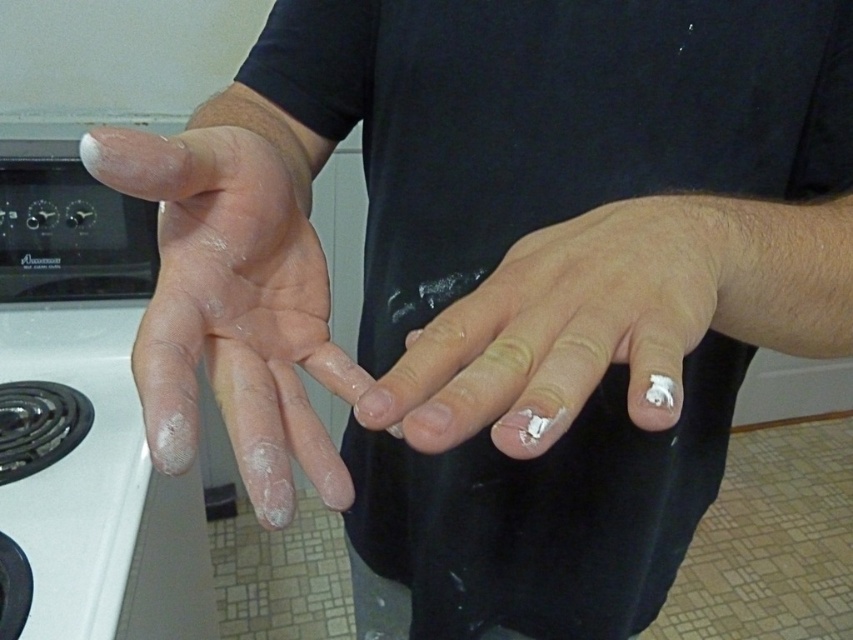
Question: Does white matte hand at center appear over white matte nails at center?

Choices:
 (A) yes
 (B) no

Answer: (A)

Question: Can you confirm if white matte hand at center is positioned above white matte nails at center?

Choices:
 (A) no
 (B) yes

Answer: (B)

Question: Is white matte hand at center smaller than white matte nails at center?

Choices:
 (A) no
 (B) yes

Answer: (A)

Question: Which of the following is the farthest from the observer?

Choices:
 (A) white matte hand at center
 (B) white matte nails at center

Answer: (A)

Question: Which point is closer to the camera?

Choices:
 (A) white matte nails at center
 (B) white matte hand at center

Answer: (A)

Question: Which object is farther from the camera taking this photo?

Choices:
 (A) white matte hand at center
 (B) white matte nails at center

Answer: (A)